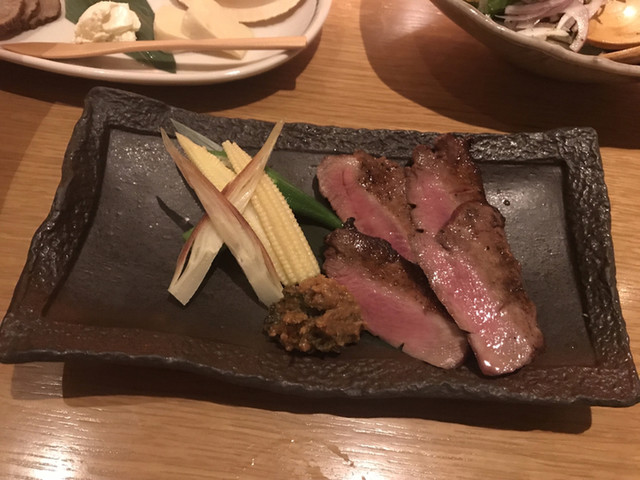
Locate an element on the screen. This screenshot has height=480, width=640. plate is located at coordinates pos(562,248).